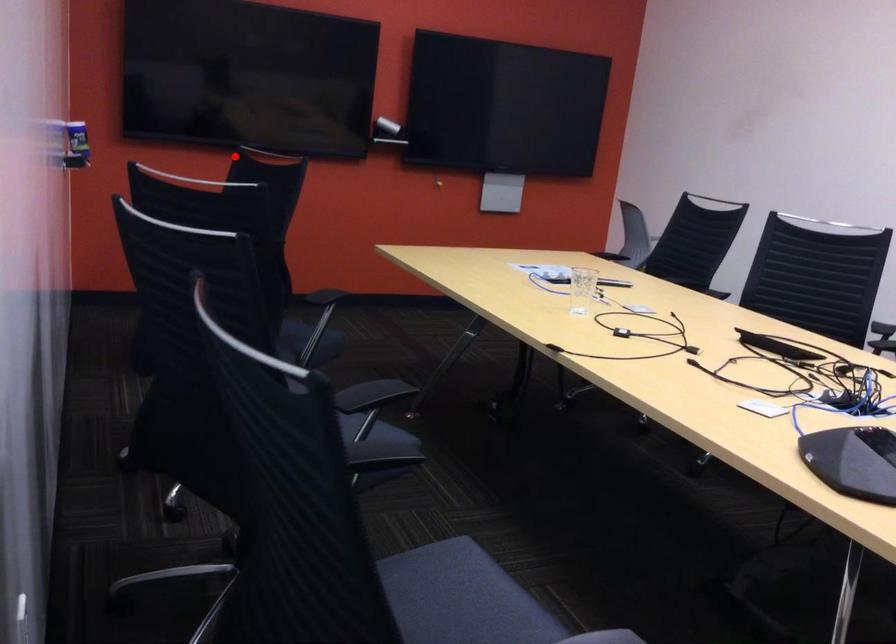
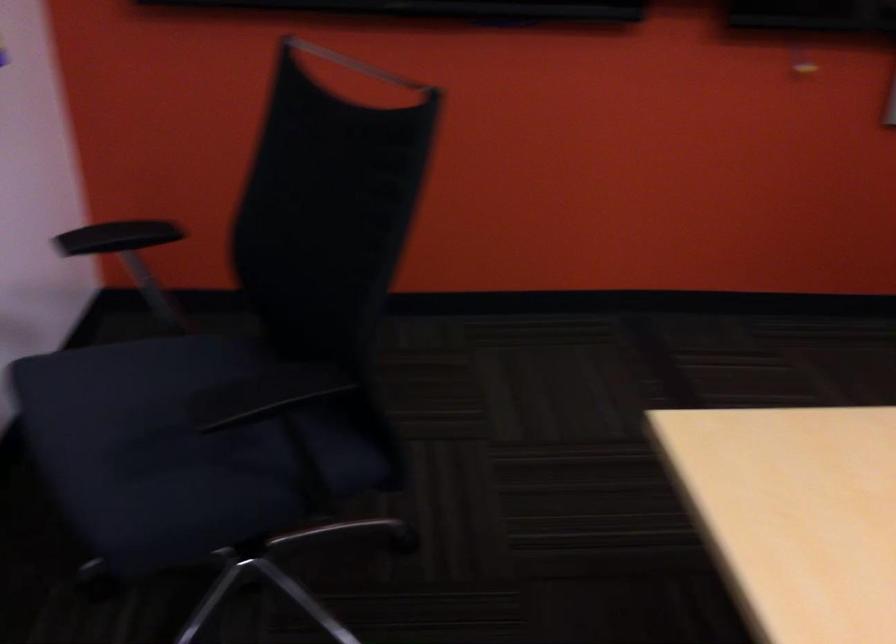
The point at the highlighted location is marked in the first image. Where is the corresponding point in the second image?

(356, 64)